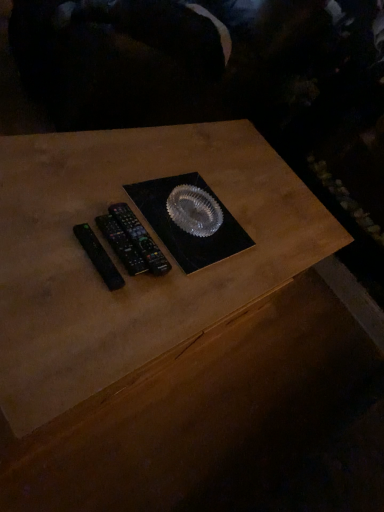
Find the location of a particular element. The image size is (384, 512). vacant space in front of black plastic remote at left, placed as the third control when sorted from back to front is located at coordinates (58, 310).